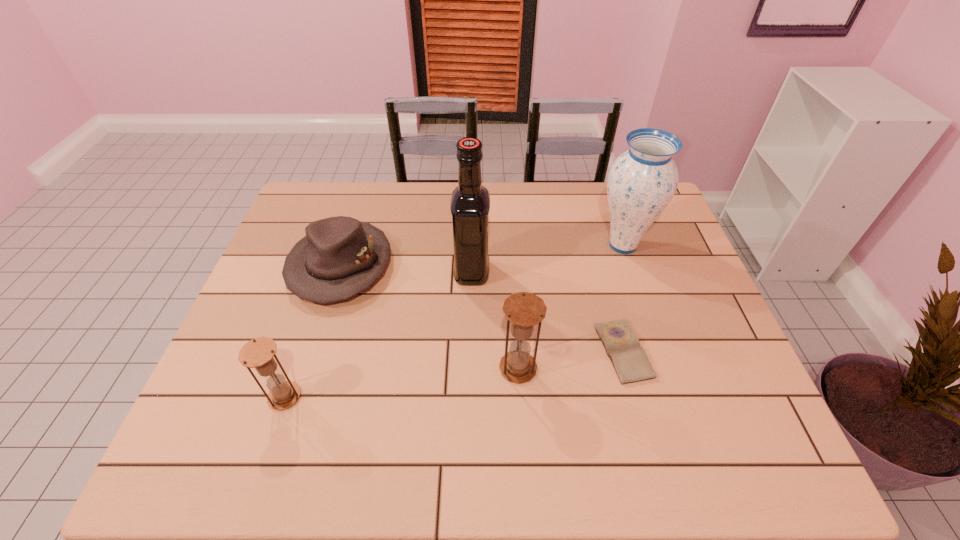
Where is `vacant space that is in between the diary and the vase`? The image size is (960, 540). vacant space that is in between the diary and the vase is located at coordinates tap(623, 298).

Locate an element on the screen. free space between the left hourglass and the second tallest object is located at coordinates (454, 321).

You are a GUI agent. You are given a task and a screenshot of the screen. Output one action in this format:
    pyautogui.click(x=<x>, y=<y>)
    Task: Click on the unoccupied position between the hat and the shorter hourglass
    This screenshot has height=540, width=960.
    Given the screenshot: What is the action you would take?
    pyautogui.click(x=313, y=331)

In order to click on object identified as the fourth closest to the third object from left to right in this screenshot , I will do `click(642, 181)`.

Find the location of a particular element. object that ranks as the third closest to the second shortest object is located at coordinates 524,310.

This screenshot has height=540, width=960. I want to click on free spot that satisfies the following two spatial constraints: 1. on the front-facing side of the fourth object from left to right; 2. on the left side of the fourth object from right to left, so click(469, 368).

The width and height of the screenshot is (960, 540). I want to click on free location that satisfies the following two spatial constraints: 1. on the back side of the diary; 2. on the front-facing side of the liquor, so click(x=602, y=272).

Identify the location of free space that satisfies the following two spatial constraints: 1. on the back side of the right hourglass; 2. on the front-facing side of the liquor. This screenshot has width=960, height=540. (512, 272).

Where is `free location that satisfies the following two spatial constraints: 1. on the front-facing side of the shortest object; 2. on the right side of the liquor`? The image size is (960, 540). free location that satisfies the following two spatial constraints: 1. on the front-facing side of the shortest object; 2. on the right side of the liquor is located at coordinates (470, 351).

Find the location of `free space that satisfies the following two spatial constraints: 1. on the back side of the diary; 2. on the left side of the shorter hourglass`. free space that satisfies the following two spatial constraints: 1. on the back side of the diary; 2. on the left side of the shorter hourglass is located at coordinates (300, 351).